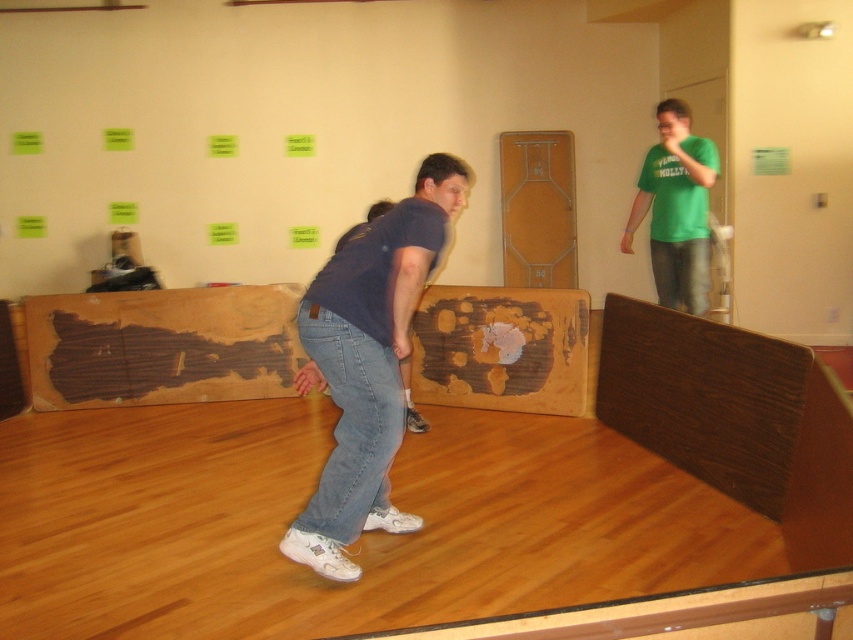
Question: Which object is positioned closest to the wooden at center?

Choices:
 (A) green matte shirt at upper right
 (B) blue denim jeans at center

Answer: (A)

Question: Is green matte shirt at upper right to the left of wooden at center from the viewer's perspective?

Choices:
 (A) no
 (B) yes

Answer: (A)

Question: Is blue denim jeans at center bigger than wooden at center?

Choices:
 (A) no
 (B) yes

Answer: (B)

Question: Considering the real-world distances, which object is farthest from the blue denim jeans at center?

Choices:
 (A) green matte shirt at upper right
 (B) wooden at center

Answer: (B)

Question: Is green matte shirt at upper right smaller than wooden at center?

Choices:
 (A) yes
 (B) no

Answer: (B)

Question: Which object is farther from the camera taking this photo?

Choices:
 (A) green matte shirt at upper right
 (B) blue denim jeans at center

Answer: (A)